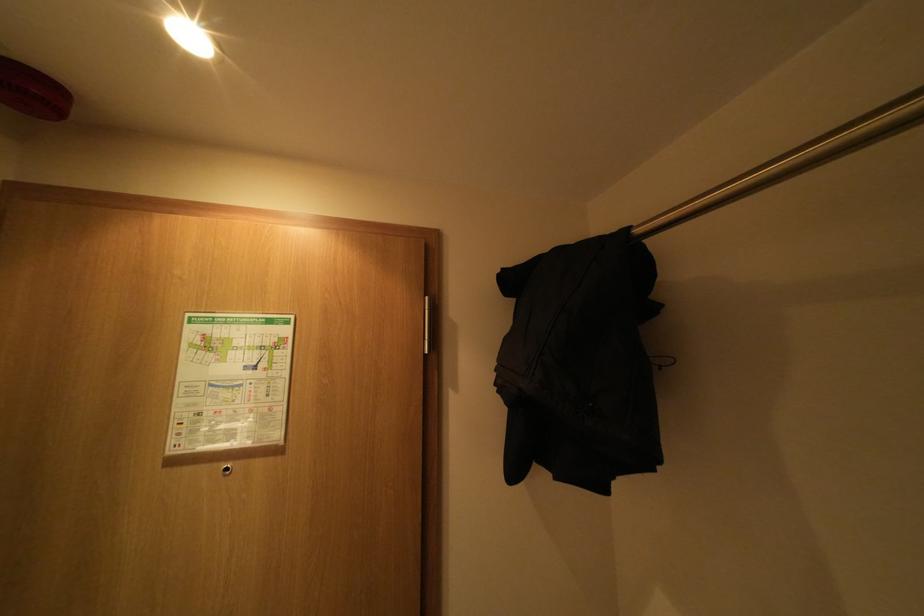
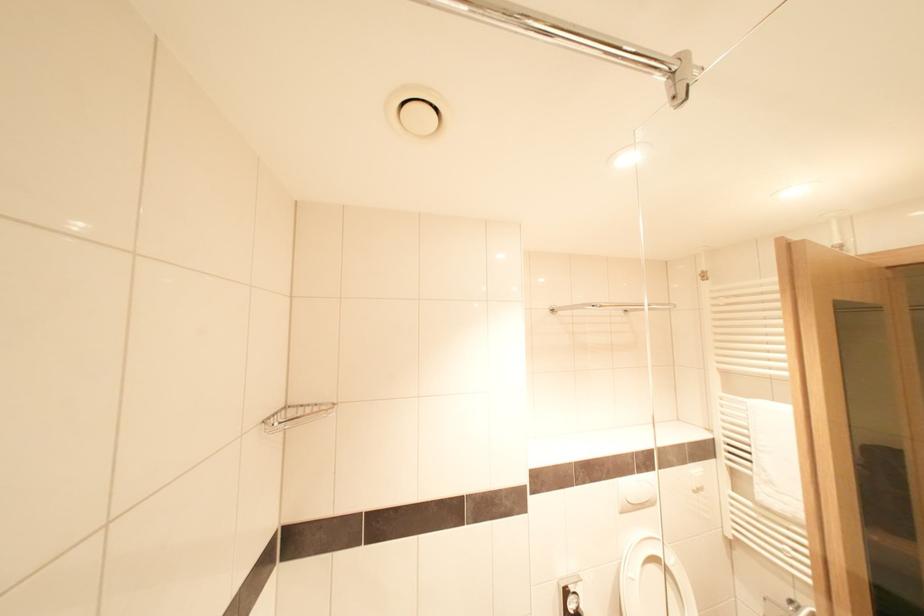
What movement of the cameraman would produce the second image?

The cameraman moved toward left, backward.